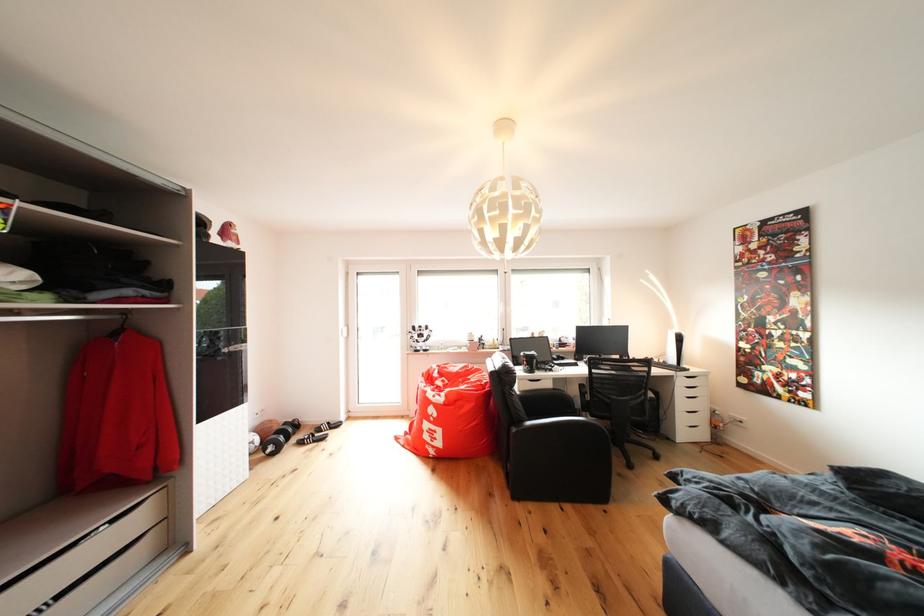
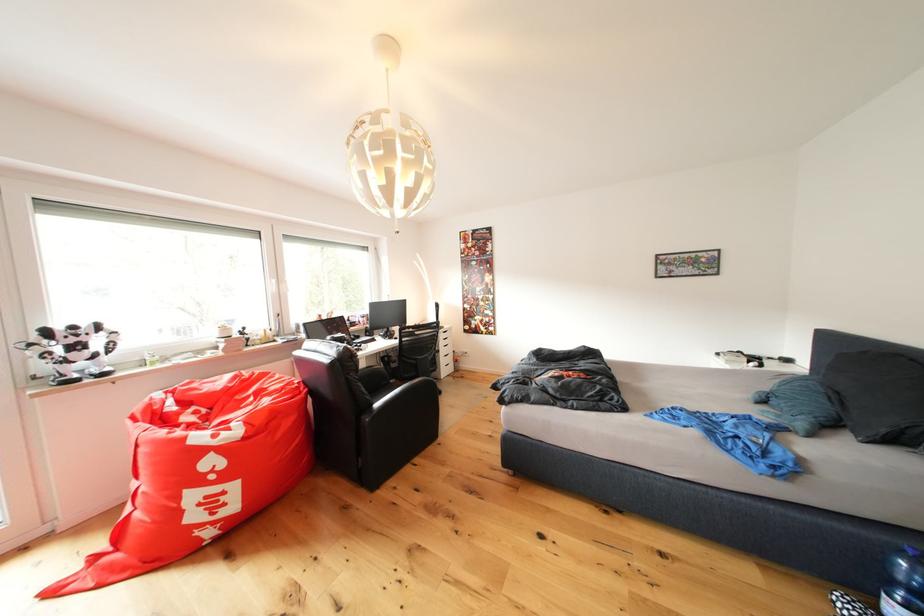
Question: Based on the continuous images, in which direction is the camera rotating? Reply with the corresponding letter.

Choices:
 (A) Left
 (B) Right
 (C) Up
 (D) Down

Answer: (B)